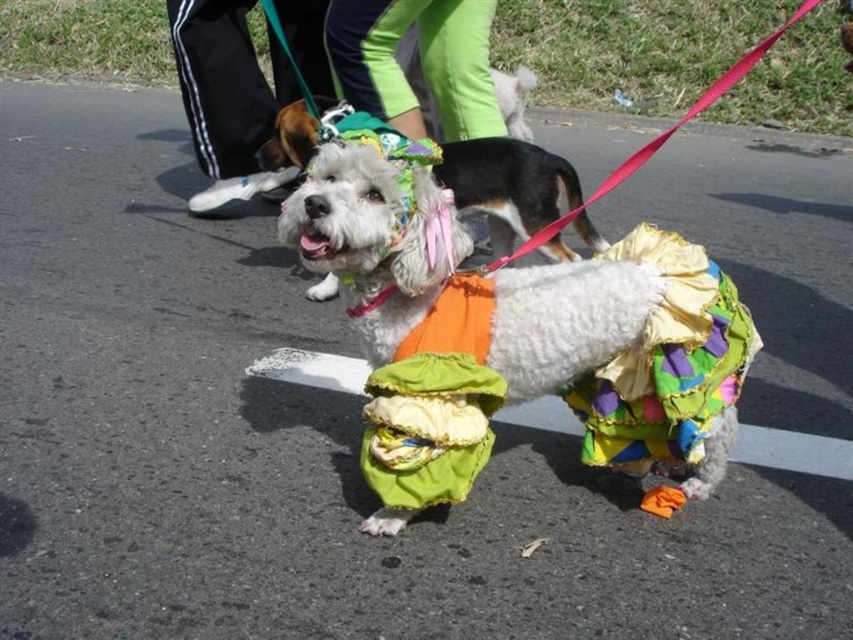
Which is above, black fabric pants at upper left or green fabric pants at center?

green fabric pants at center is higher up.

Between point (190, 1) and point (428, 44), which one is positioned behind?

The point (190, 1) is behind.

The height and width of the screenshot is (640, 853). I want to click on black fabric pants at upper left, so click(227, 97).

Is white fluffy dog at center above green fabric pants at center?

No.

Find the location of a particular element. This screenshot has width=853, height=640. white fluffy dog at center is located at coordinates (514, 332).

Can you confirm if white fluffy dog at center is positioned to the right of black fabric pants at upper left?

Yes, white fluffy dog at center is to the right of black fabric pants at upper left.

Does white fluffy dog at center have a smaller size compared to black fabric pants at upper left?

Indeed, white fluffy dog at center has a smaller size compared to black fabric pants at upper left.

Which is behind, point (469, 330) or point (276, 81)?

Positioned behind is point (276, 81).

This screenshot has height=640, width=853. Find the location of `white fluffy dog at center`. white fluffy dog at center is located at coordinates (514, 332).